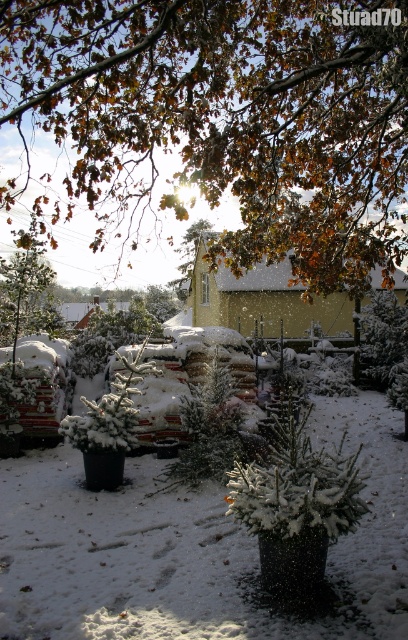
Question: Which point is closer to the camera taking this photo?

Choices:
 (A) (121, 97)
 (B) (39, 257)

Answer: (A)

Question: Is brown leafy tree at upper center to the right of green matte tree at center from the viewer's perspective?

Choices:
 (A) no
 (B) yes

Answer: (B)

Question: Does green textured evergreen tree at center have a greater width compared to green matte tree at center?

Choices:
 (A) no
 (B) yes

Answer: (A)

Question: Which point is closer to the camera?

Choices:
 (A) green matte tree at center
 (B) green textured evergreen tree at center
 (C) green matte tree at upper left
 (D) brown leafy tree at upper center

Answer: (D)

Question: Which object appears farthest from the camera in this image?

Choices:
 (A) green textured evergreen tree at center
 (B) green matte tree at center

Answer: (B)

Question: Can you confirm if brown leafy tree at upper center is positioned to the left of green matte tree at upper left?

Choices:
 (A) yes
 (B) no

Answer: (B)